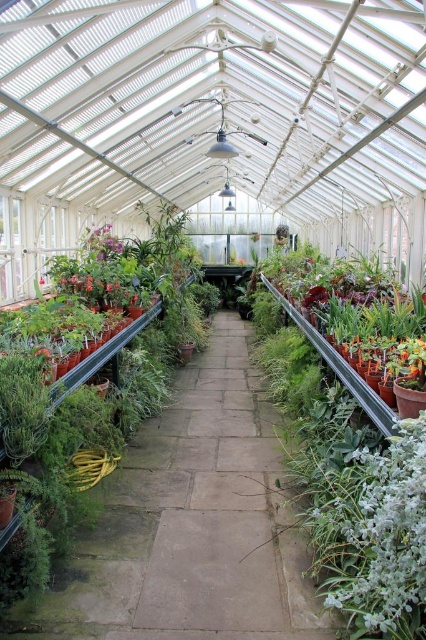
Question: Which object appears farthest from the camera in this image?

Choices:
 (A) green matte plant at left
 (B) green succulent at right
 (C) pink matte flower at center

Answer: (C)

Question: Which is farther from the green succulent at right?

Choices:
 (A) pink matte flower at center
 (B) green matte plant at left

Answer: (A)

Question: Is green succulent at right thinner than pink matte flower at center?

Choices:
 (A) no
 (B) yes

Answer: (B)

Question: Is green succulent at right in front of green matte plant at left?

Choices:
 (A) yes
 (B) no

Answer: (A)

Question: Which object appears farthest from the camera in this image?

Choices:
 (A) green succulent at right
 (B) pink matte flower at center
 (C) green matte plant at left

Answer: (B)

Question: Does green succulent at right appear under pink matte flower at center?

Choices:
 (A) yes
 (B) no

Answer: (A)